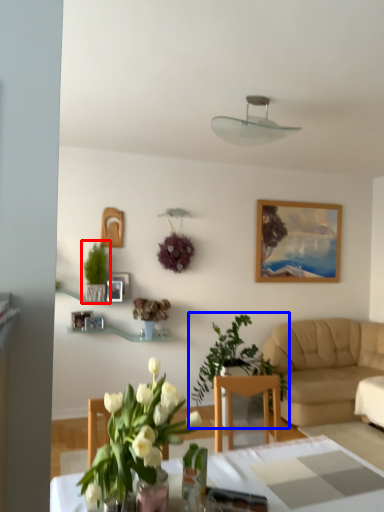
Question: Which of the following is the farthest to the observer, houseplant (highlighted by a red box) or houseplant (highlighted by a blue box)?

Choices:
 (A) houseplant
 (B) houseplant

Answer: (A)